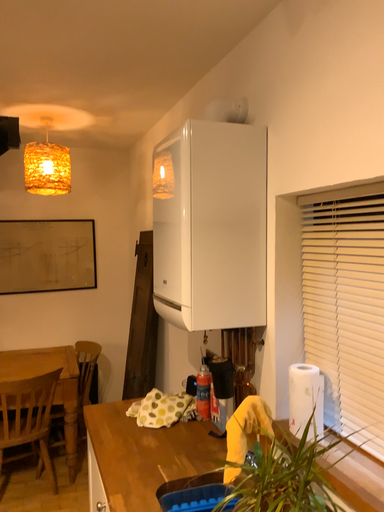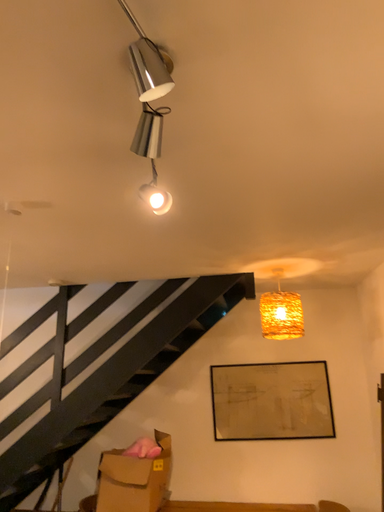
Question: How did the camera likely rotate when shooting the video?

Choices:
 (A) rotated right
 (B) rotated left

Answer: (B)